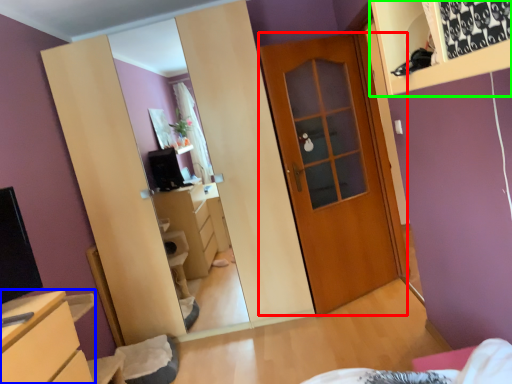
Question: Which object is the closest to the door (highlighted by a red box)? Choose among these: chest of drawers (highlighted by a blue box) or shelf (highlighted by a green box).

Choices:
 (A) chest of drawers
 (B) shelf

Answer: (A)